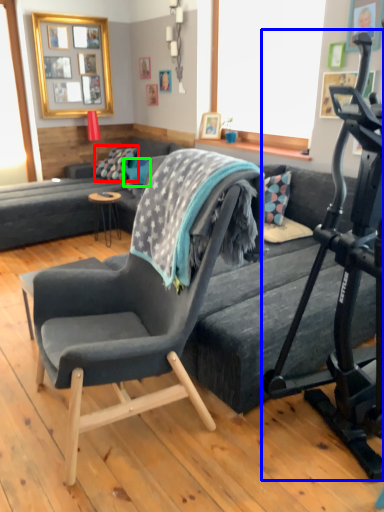
Question: Estimate the real-world distances between objects in this image. Which object is farther from pillow (highlighted by a red box), treadmill (highlighted by a blue box) or pillow (highlighted by a green box)?

Choices:
 (A) treadmill
 (B) pillow

Answer: (A)